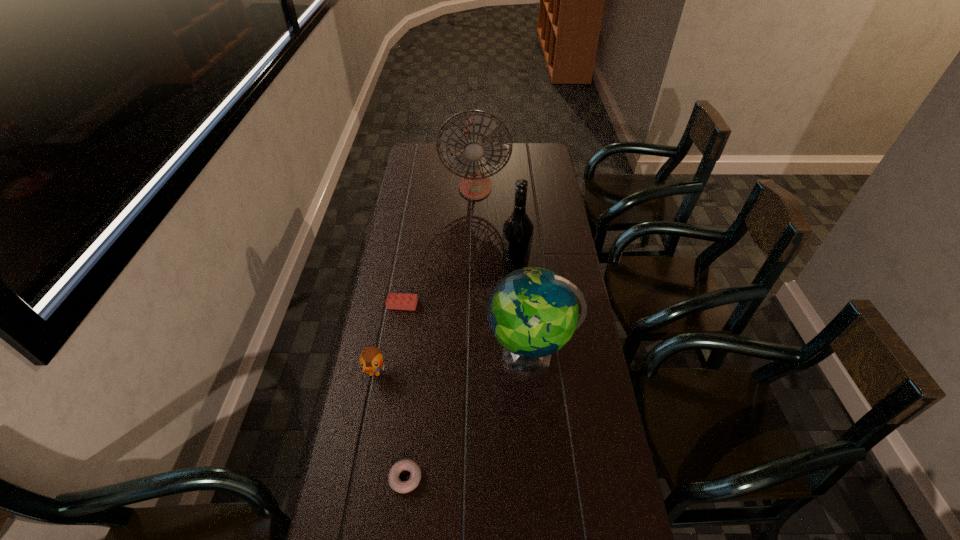
Where is `doughnut located at the left edge`? The height and width of the screenshot is (540, 960). doughnut located at the left edge is located at coordinates pyautogui.click(x=396, y=484).

You are a GUI agent. You are given a task and a screenshot of the screen. Output one action in this format:
    pyautogui.click(x=<x>, y=<y>)
    Task: Click on the object situated at the right edge
    This screenshot has width=960, height=540.
    Given the screenshot: What is the action you would take?
    pyautogui.click(x=533, y=312)

At what (x,y) coordinates should I click in order to perform the action: click on vacant space at the left edge. Please return your answer as a coordinate pair (x, y). Looking at the image, I should click on (399, 387).

The height and width of the screenshot is (540, 960). Identify the location of vacant space at the right edge. (559, 195).

Identify the location of free space at the far left corner. The image size is (960, 540). (431, 153).

Where is `free space at the far right corner of the desktop`? The height and width of the screenshot is (540, 960). free space at the far right corner of the desktop is located at coordinates (540, 150).

Locate an element on the screen. The width and height of the screenshot is (960, 540). free space that is in between the second farthest object and the nearest object is located at coordinates (461, 372).

This screenshot has height=540, width=960. I want to click on free space between the fifth nearest object and the fan, so click(x=495, y=226).

You are a GUI agent. You are given a task and a screenshot of the screen. Output one action in this format:
    pyautogui.click(x=<x>, y=<y>)
    Task: Click on the blank region between the fifth nearest object and the nearest object
    
    Given the screenshot: What is the action you would take?
    pyautogui.click(x=461, y=372)

This screenshot has width=960, height=540. What are the coordinates of `empty space between the nearest object and the Lego` in the screenshot? It's located at (404, 392).